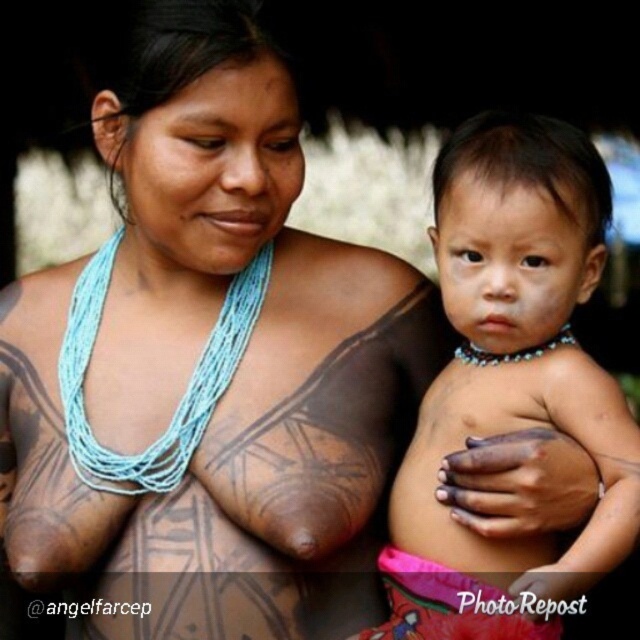
Question: Does matte skin baby at center have a lesser width compared to blue beaded necklace at upper center?

Choices:
 (A) no
 (B) yes

Answer: (A)

Question: Among these objects, which one is farthest from the camera?

Choices:
 (A) blue string necklace at upper center
 (B) blue beaded necklace at upper center
 (C) brown skin tattoo at upper center
 (D) matte skin baby at center

Answer: (B)

Question: Can you confirm if blue string necklace at upper center is positioned to the right of blue beaded necklace at upper center?

Choices:
 (A) no
 (B) yes

Answer: (B)

Question: Among these points, which one is nearest to the camera?

Choices:
 (A) (163, 442)
 (B) (509, 234)
 (C) (186, 289)

Answer: (B)

Question: Does brown skin tattoo at upper center appear on the right side of blue string necklace at upper center?

Choices:
 (A) no
 (B) yes

Answer: (B)

Question: Estimate the real-world distances between objects in this image. Which object is closer to the brown skin tattoo at upper center?

Choices:
 (A) blue string necklace at upper center
 (B) blue beaded necklace at upper center
 (C) matte skin baby at center

Answer: (A)